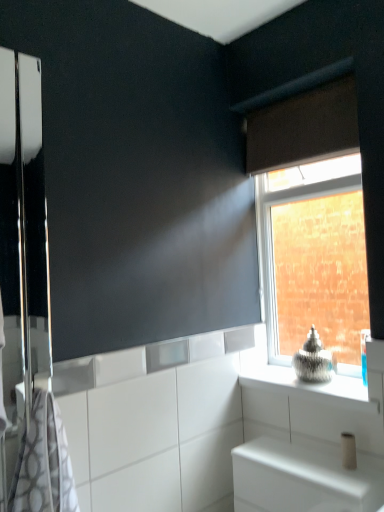
Question: From a real-world perspective, is gray-patterned towel at left located beneath white glossy cabinet at lower right?

Choices:
 (A) yes
 (B) no

Answer: (B)

Question: From a real-world perspective, is gray-patterned towel at left physically above white glossy cabinet at lower right?

Choices:
 (A) no
 (B) yes

Answer: (B)

Question: Considering the relative positions of gray-patterned towel at left and white glossy cabinet at lower right in the image provided, is gray-patterned towel at left to the right of white glossy cabinet at lower right from the viewer's perspective?

Choices:
 (A) yes
 (B) no

Answer: (B)

Question: From the image's perspective, is gray-patterned towel at left below white glossy cabinet at lower right?

Choices:
 (A) yes
 (B) no

Answer: (B)

Question: Is white glossy cabinet at lower right located within gray-patterned towel at left?

Choices:
 (A) yes
 (B) no

Answer: (B)

Question: In terms of height, does clear glass window at upper right look taller or shorter compared to metallic silver vase at upper right?

Choices:
 (A) tall
 (B) short

Answer: (A)

Question: Is point (248, 135) positioned closer to the camera than point (299, 386)?

Choices:
 (A) closer
 (B) farther

Answer: (B)

Question: Based on their sizes in the image, would you say clear glass window at upper right is bigger or smaller than metallic silver vase at upper right?

Choices:
 (A) big
 (B) small

Answer: (A)

Question: Considering their positions, is clear glass window at upper right located in front of or behind metallic silver vase at upper right?

Choices:
 (A) behind
 (B) front

Answer: (A)

Question: Does point (339, 148) appear closer or farther from the camera than point (355, 464)?

Choices:
 (A) farther
 (B) closer

Answer: (A)

Question: Relative to white matte toilet paper at lower right, is brown fabric curtain at upper right in front or behind?

Choices:
 (A) front
 (B) behind

Answer: (B)

Question: From the image's perspective, is brown fabric curtain at upper right positioned above or below white matte toilet paper at lower right?

Choices:
 (A) below
 (B) above

Answer: (B)

Question: Is brown fabric curtain at upper right bigger or smaller than white matte toilet paper at lower right?

Choices:
 (A) small
 (B) big

Answer: (B)

Question: Is point (66, 484) closer or farther from the camera than point (350, 443)?

Choices:
 (A) closer
 (B) farther

Answer: (A)

Question: Would you say gray-patterned towel at left is to the left or to the right of white matte toilet paper at lower right in the picture?

Choices:
 (A) left
 (B) right

Answer: (A)